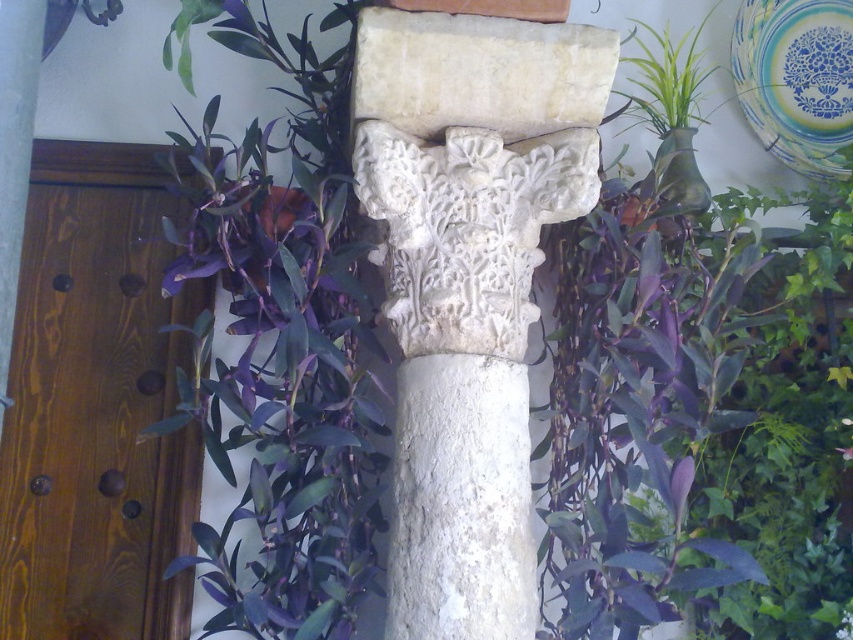
Does white stone column at center have a larger size compared to purple leafy plant at center?

Incorrect, white stone column at center is not larger than purple leafy plant at center.

Does white stone column at center appear on the right side of purple leafy plant at center?

Correct, you'll find white stone column at center to the right of purple leafy plant at center.

Is point (418, 104) behind point (207, 189)?

That is False.

Where is `white stone column at center`? The width and height of the screenshot is (853, 640). white stone column at center is located at coordinates (468, 285).